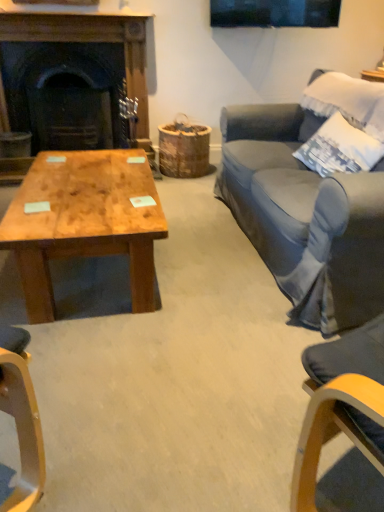
The width and height of the screenshot is (384, 512). I want to click on free space in front of natural wood coffee table at lower left, so click(x=143, y=377).